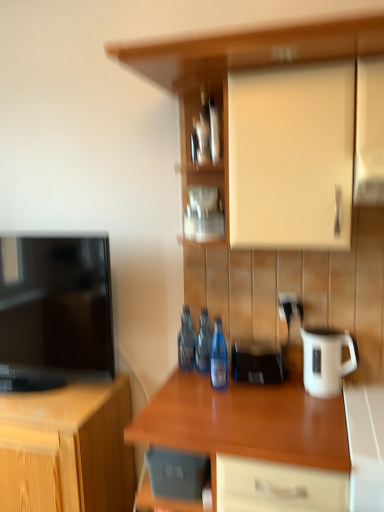
Question: Considering the positions of point (44, 354) and point (215, 238), is point (44, 354) closer or farther from the camera than point (215, 238)?

Choices:
 (A) closer
 (B) farther

Answer: (B)

Question: Do you think black glossy television at left is within metallic silver frame at center, the 1th shelf in the back-to-front sequence, or outside of it?

Choices:
 (A) outside
 (B) inside

Answer: (A)

Question: Which is nearer to the wooden cabinet at left, which appears as the second cabinetry when viewed from the top?

Choices:
 (A) white plastic electric outlet at center-right
 (B) matte wood cabinet at upper center, which ranks as the second cabinetry in left-to-right order
 (C) blue glass bottle at center, the third bottle in the back-to-front sequence
 (D) black glossy television at left
 (E) transparent glass bottle at center, which appears as the second bottle when viewed from the front

Answer: (D)

Question: Considering the real-world distances, which object is farthest from the glossy wood countertop at center?

Choices:
 (A) metallic silver bottle at center, the first bottle viewed from the back
 (B) wooden shelves at center, which appears as the first shelf when viewed from the front
 (C) white glossy jug at right
 (D) metallic silver frame at center, the 1th shelf in the back-to-front sequence
 (E) white glossy counter at lower right

Answer: (B)